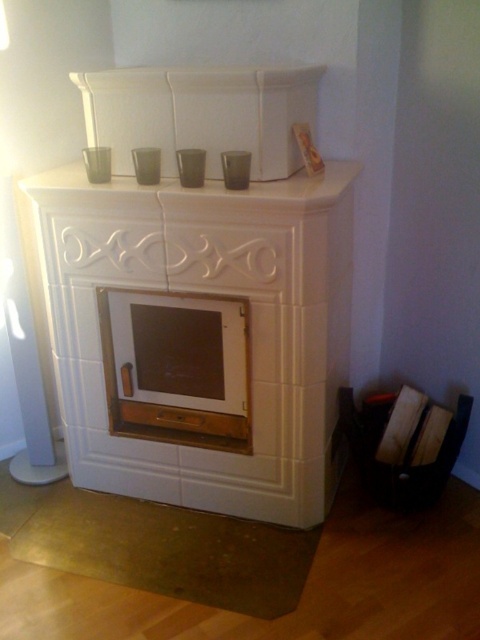
Question: Estimate the real-world distances between objects in this image. Which object is closer to the white glossy fireplace at center?

Choices:
 (A) white glossy mantle at upper center
 (B) wooden frame at upper center

Answer: (A)

Question: Estimate the real-world distances between objects in this image. Which object is closer to the wooden fireplace at center?

Choices:
 (A) white glossy mantle at upper center
 (B) wooden frame at upper center
 (C) white glossy fireplace at center

Answer: (C)

Question: Does white glossy mantle at upper center have a smaller size compared to wooden frame at upper center?

Choices:
 (A) yes
 (B) no

Answer: (B)

Question: Where is white glossy mantle at upper center located in relation to wooden frame at upper center in the image?

Choices:
 (A) right
 (B) left

Answer: (B)

Question: In this image, where is wooden fireplace at center located relative to white glossy mantle at upper center?

Choices:
 (A) above
 (B) below

Answer: (B)

Question: Which object is closer to the camera taking this photo?

Choices:
 (A) white glossy fireplace at center
 (B) white glossy mantle at upper center
 (C) wooden frame at upper center
 (D) wooden fireplace at center

Answer: (B)